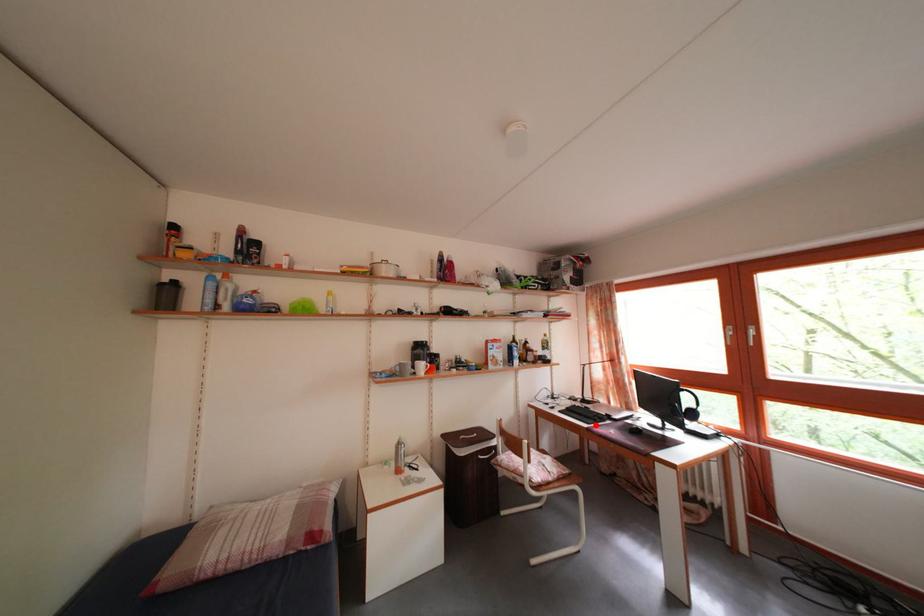
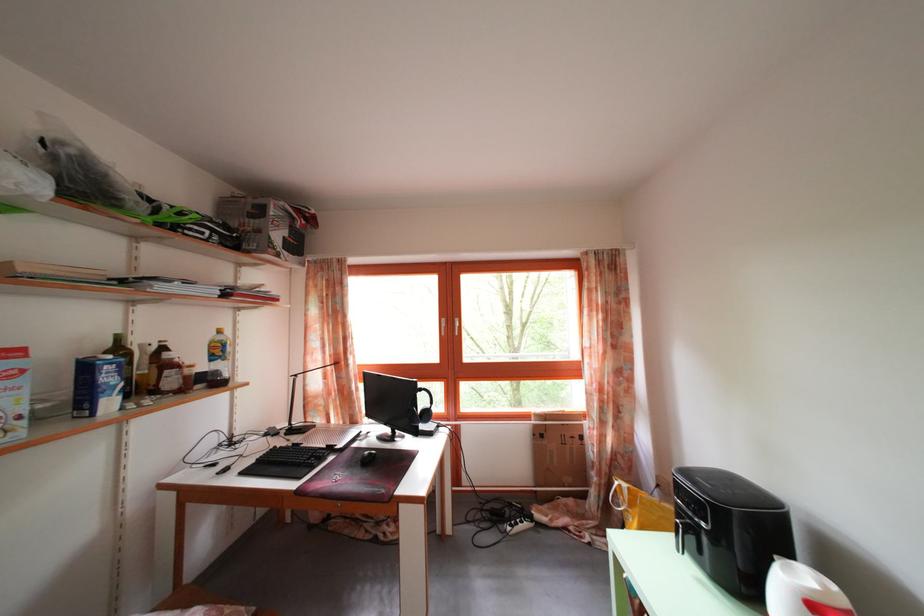
The point at the highlighted location is marked in the first image. Where is the corresponding point in the second image?

(307, 472)